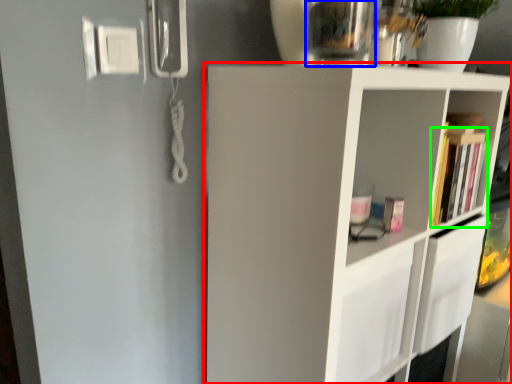
Question: Estimate the real-world distances between objects in this image. Which object is farther from shelf (highlighted by a red box), glass vase (highlighted by a blue box) or book (highlighted by a green box)?

Choices:
 (A) glass vase
 (B) book

Answer: (A)